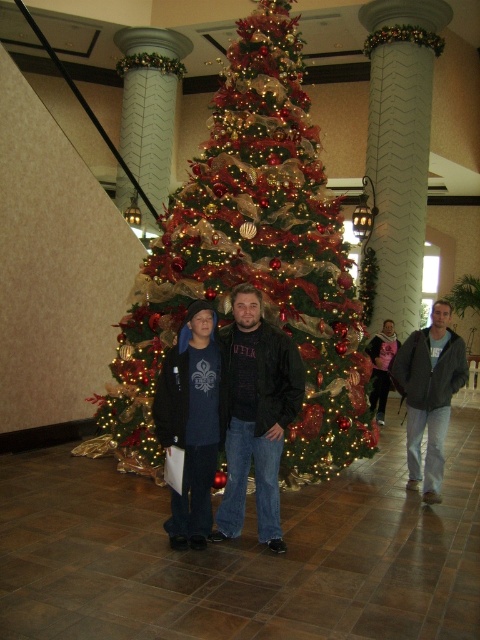
You are organizing a photo shoot and need to ensure that the green textured christmas tree at center does not block the black matte jacket at center in the image. Based on their sizes, which object is wider and might require more space in the frame?

The green textured christmas tree at center is wider than the black matte jacket at center, so it requires more space in the frame to avoid blocking.

You are planning to take a photo of the green textured christmas tree at center and the gray cotton jacket at center. Which object is wider in the image?

The green textured christmas tree at center is wider than the gray cotton jacket at center.

From the picture: You are a photographer setting up for a group photo. You need to ensure that the green textured christmas tree at center and the gray cotton jacket at center are within a 4 feet distance to frame them properly. Based on the scene description, can you confirm if they are close enough?

The green textured christmas tree at center and gray cotton jacket at center are 3.82 feet apart, which is within the 4 feet requirement, so they can be framed properly.